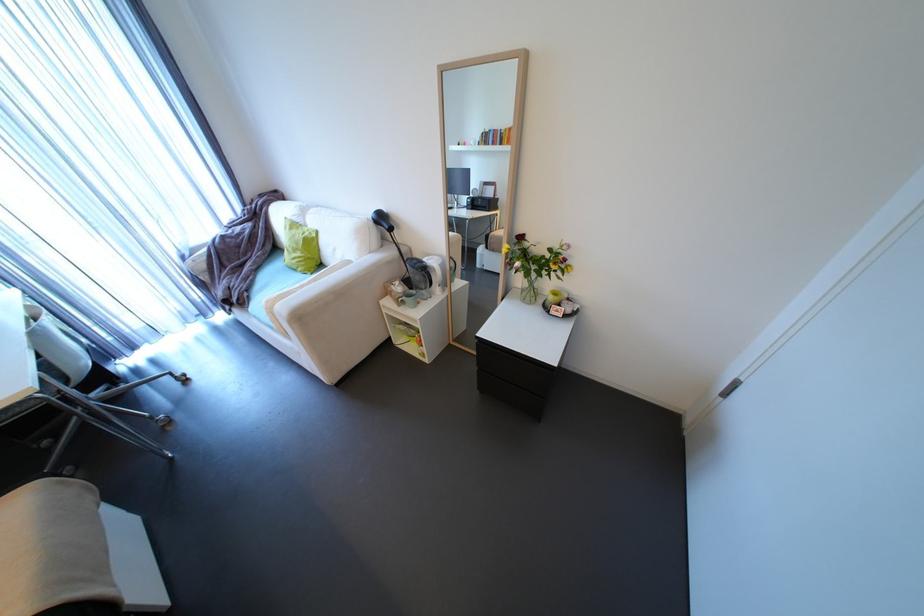
Where is `green cushion`? This screenshot has height=616, width=924. green cushion is located at coordinates (300, 246).